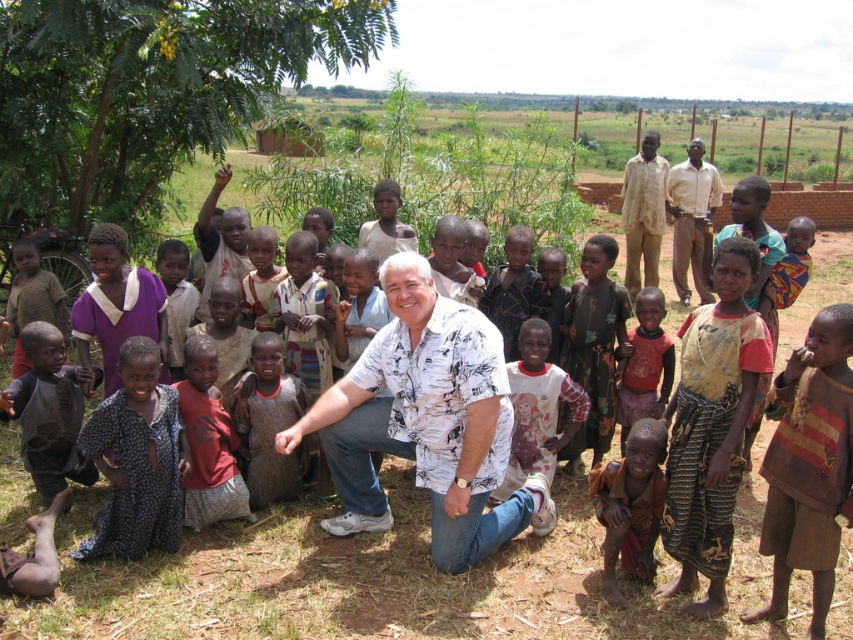
Does brown dirt field at center have a greater width compared to white printed shirt at center?

Yes, brown dirt field at center is wider than white printed shirt at center.

Looking at this image, is brown dirt field at center positioned in front of white printed shirt at center?

Yes, brown dirt field at center is closer to the viewer.

Between point (135, 572) and point (357, 426), which one is positioned in front?

Point (135, 572) is in front.

This screenshot has height=640, width=853. I want to click on brown dirt field at center, so click(x=383, y=579).

From the picture: Does white printed shirt at center appear on the left side of light brown shirt at upper right?

Correct, you'll find white printed shirt at center to the left of light brown shirt at upper right.

Between point (433, 540) and point (718, 195), which one is positioned behind?

Positioned behind is point (718, 195).

The height and width of the screenshot is (640, 853). Find the location of `white printed shirt at center`. white printed shirt at center is located at coordinates (422, 420).

Between brown textured cloth at lower center and light brown fabric shirt at upper right, which one appears on the left side from the viewer's perspective?

From the viewer's perspective, brown textured cloth at lower center appears more on the left side.

Between point (250, 436) and point (654, 188), which one is positioned in front?

Positioned in front is point (250, 436).

From the picture: Who is more forward, (276, 358) or (656, 170)?

Point (276, 358) is more forward.

What are the coordinates of `brown textured cloth at lower center` in the screenshot? It's located at (270, 426).